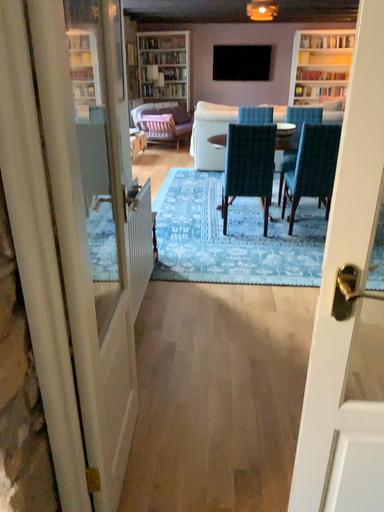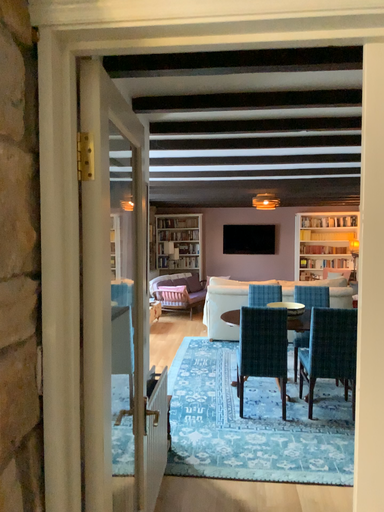
Question: Which way did the camera rotate in the video?

Choices:
 (A) rotated upward
 (B) rotated downward

Answer: (A)